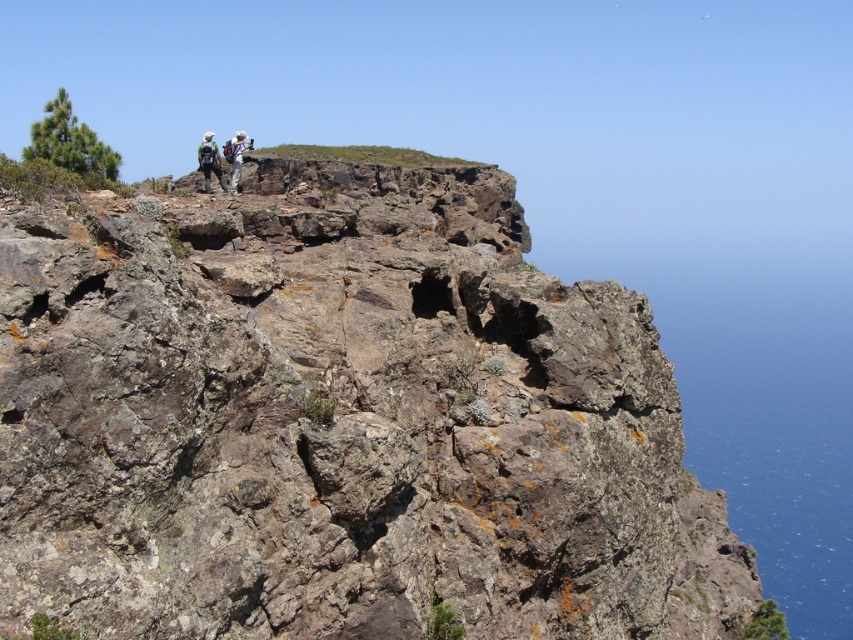
You are standing at the top of the cliff and want to take a photo of the rocky area. Where should you position yourself to capture the rocky at upper center at point (340,422) in the center of your camera view?

To capture the rocky at upper center at point (340,422) in the center of your camera view, you should position yourself directly in front of the rocky area at upper center, aligning the camera lens with the coordinates provided.